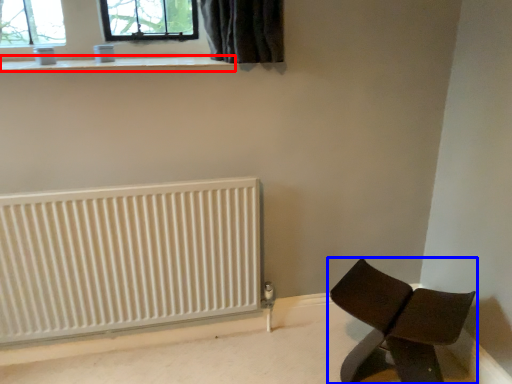
Question: Which point is closer to the camera, window sill (highlighted by a red box) or furniture (highlighted by a blue box)?

Choices:
 (A) window sill
 (B) furniture

Answer: (B)